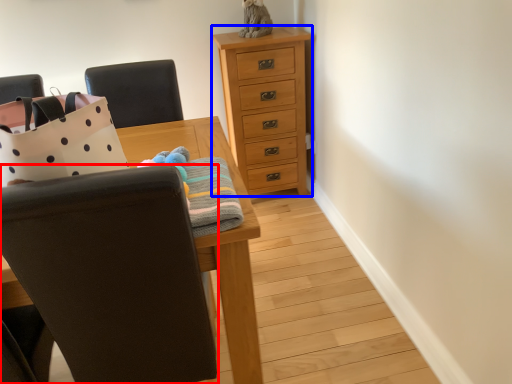
Question: Which point is closer to the camera, chair (highlighted by a red box) or chest of drawers (highlighted by a blue box)?

Choices:
 (A) chair
 (B) chest of drawers

Answer: (A)